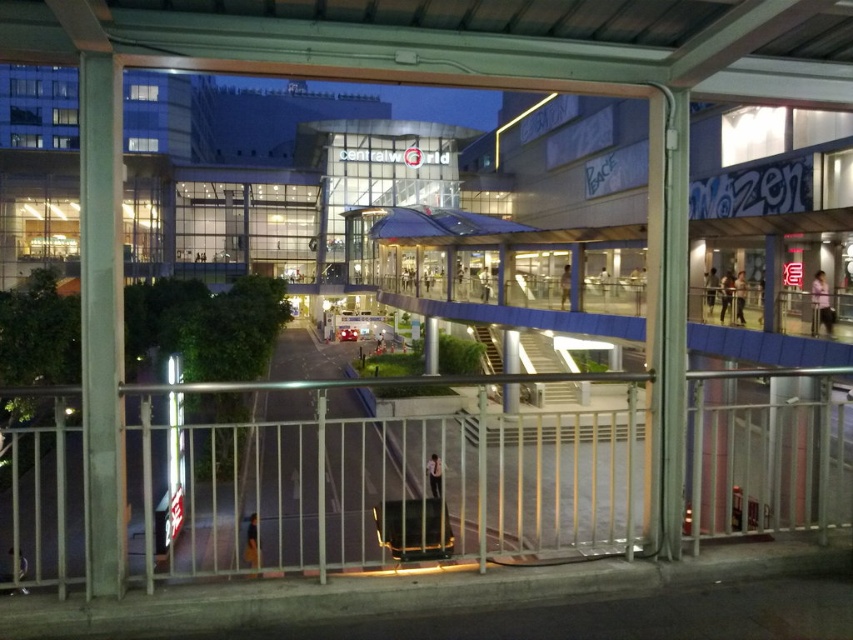
Is metallic silver railing at center below concrete pillar at left?

Indeed, metallic silver railing at center is positioned under concrete pillar at left.

You are a GUI agent. You are given a task and a screenshot of the screen. Output one action in this format:
    pyautogui.click(x=<x>, y=<y>)
    Task: Click on the metallic silver railing at center
    
    Given the screenshot: What is the action you would take?
    pyautogui.click(x=379, y=486)